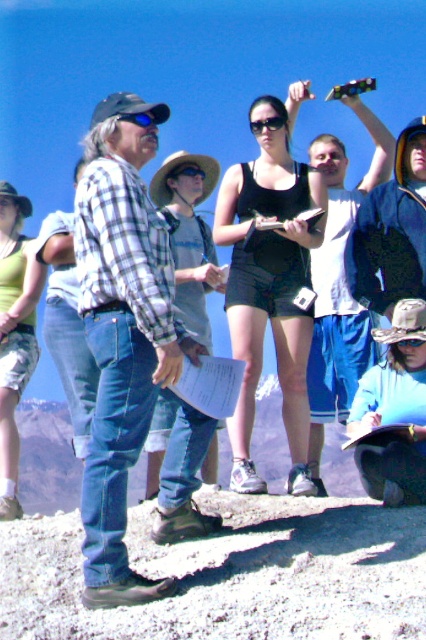
You are a hiker trying to decide which clothing item to wear for better comfort during a long hike. Considering the blue denim jeans at lower center and the camouflage shorts at center, which one has a wider leg opening?

The blue denim jeans at lower center has a wider leg opening than the camouflage shorts at center.

From the picture: You are standing at the origin point of the coordinate system where the image is displayed. The blue denim jeans at lower center is at point (394, 412). If you want to move towards the blue denim jeans at lower center, in which direction should you move?

You should move towards the point (394, 412) to reach the blue denim jeans at lower center.